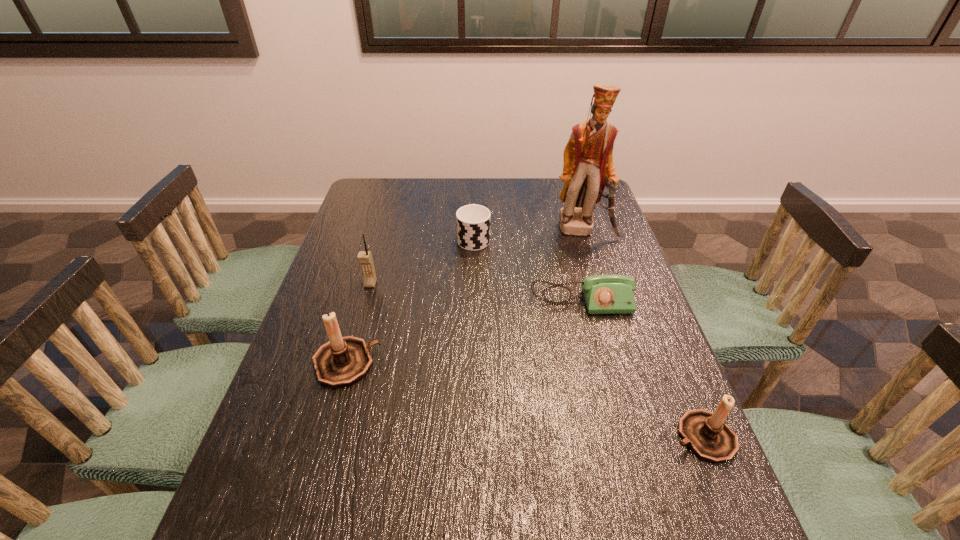
This screenshot has height=540, width=960. Find the location of `the farther candle holder`. the farther candle holder is located at coordinates (342, 361).

This screenshot has height=540, width=960. I want to click on the second nearest object, so pyautogui.click(x=342, y=361).

At what (x,y) coordinates should I click in order to perform the action: click on the nearest object. Please return your answer as a coordinate pair (x, y). Looking at the image, I should click on (710, 438).

At what (x,y) coordinates should I click in order to perform the action: click on the fourth tallest object. Please return your answer as a coordinate pair (x, y). This screenshot has width=960, height=540. Looking at the image, I should click on (710, 438).

Identify the location of the fourth object from right to left. The image size is (960, 540). pos(473,221).

Identify the location of the fifth tallest object. Image resolution: width=960 pixels, height=540 pixels. (x=473, y=221).

Where is `nutcracker`? This screenshot has width=960, height=540. nutcracker is located at coordinates (588, 167).

This screenshot has width=960, height=540. Find the location of `the shortest object`. the shortest object is located at coordinates (604, 294).

The width and height of the screenshot is (960, 540). I want to click on cellular telephone, so click(x=365, y=259).

This screenshot has width=960, height=540. I want to click on free space located 0.390m on the back of the second nearest object, so click(x=380, y=245).